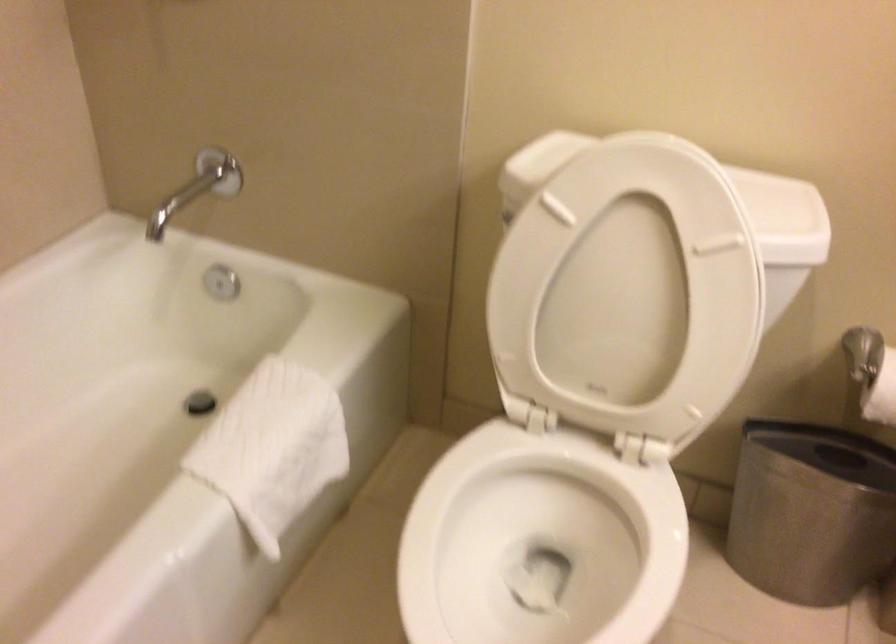
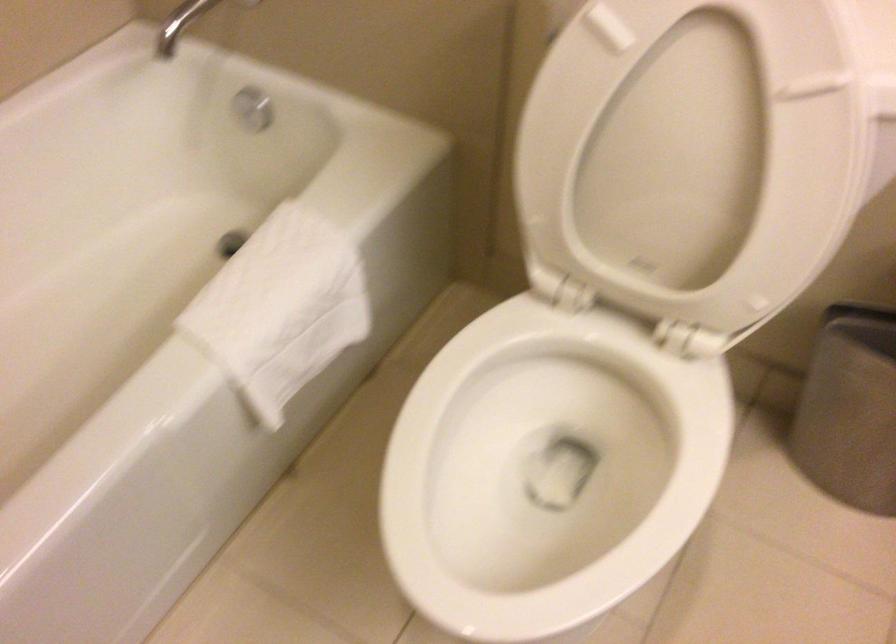
Find the pixel in the second image that matches the point at 277,444 in the first image.

(282, 303)